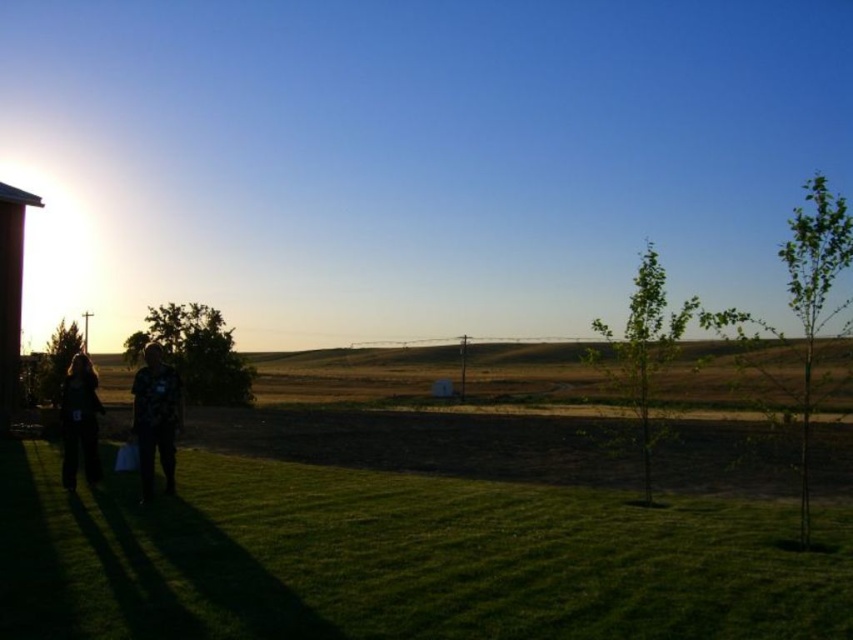
Question: Which point is farther from the camera taking this photo?

Choices:
 (A) (79, 429)
 (B) (96, 477)
 (C) (22, 257)
 (D) (138, 381)

Answer: (C)

Question: From the image, what is the correct spatial relationship of green grassy at lower left in relation to camouflage fabric shirt at lower left?

Choices:
 (A) right
 (B) left

Answer: (A)

Question: Is green grassy at lower left smaller than camouflage fabric shirt at lower left?

Choices:
 (A) yes
 (B) no

Answer: (A)

Question: Where is rustic wooden hut at left located in relation to dark clothing figure at lower left in the image?

Choices:
 (A) above
 (B) below

Answer: (A)

Question: Among these objects, which one is farthest from the camera?

Choices:
 (A) green grassy at lower left
 (B) rustic wooden hut at left

Answer: (B)

Question: Which is nearer to the rustic wooden hut at left?

Choices:
 (A) dark clothing figure at lower left
 (B) dark clothing couple at lower left
 (C) camouflage fabric shirt at lower left
 (D) green grassy at lower left

Answer: (C)